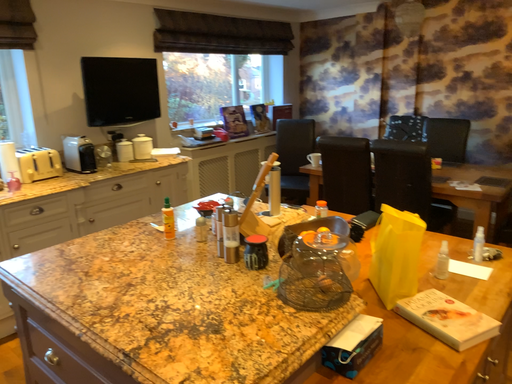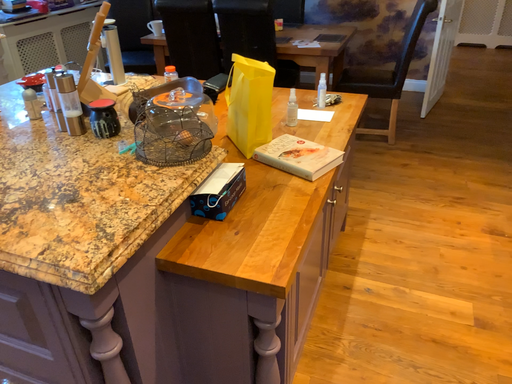
Question: Which way did the camera rotate in the video?

Choices:
 (A) rotated left
 (B) rotated right

Answer: (B)